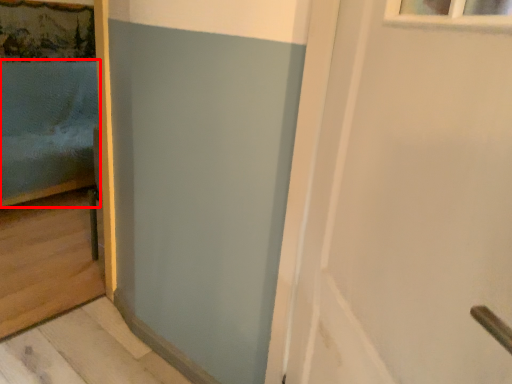
Question: From the image's perspective, what is the correct spatial positioning of bed (annotated by the red box) in reference to door?

Choices:
 (A) below
 (B) above

Answer: (B)